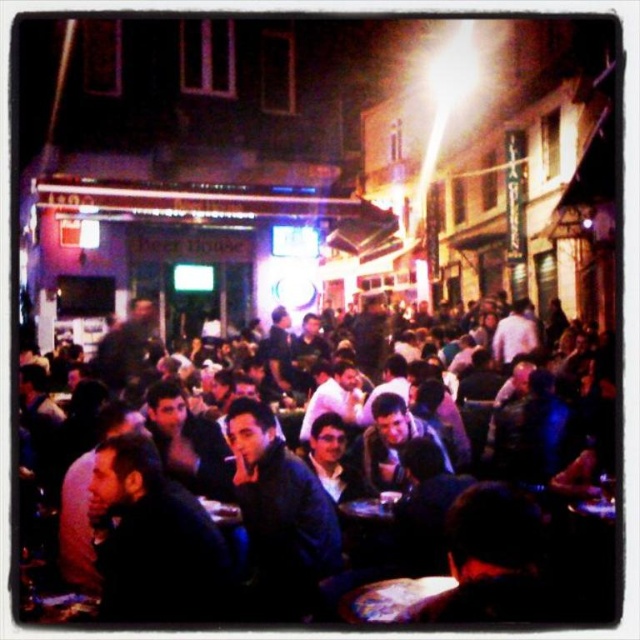
Question: Does dark blue clothing at center have a smaller size compared to shiny metallic table at center?

Choices:
 (A) yes
 (B) no

Answer: (B)

Question: Which point is farther from the camera taking this photo?

Choices:
 (A) (397, 589)
 (B) (348, 582)

Answer: (B)

Question: Is dark blue clothing at center closer to camera compared to shiny metallic table at center?

Choices:
 (A) yes
 (B) no

Answer: (A)

Question: Does dark blue clothing at center have a smaller size compared to shiny metallic table at center?

Choices:
 (A) no
 (B) yes

Answer: (A)